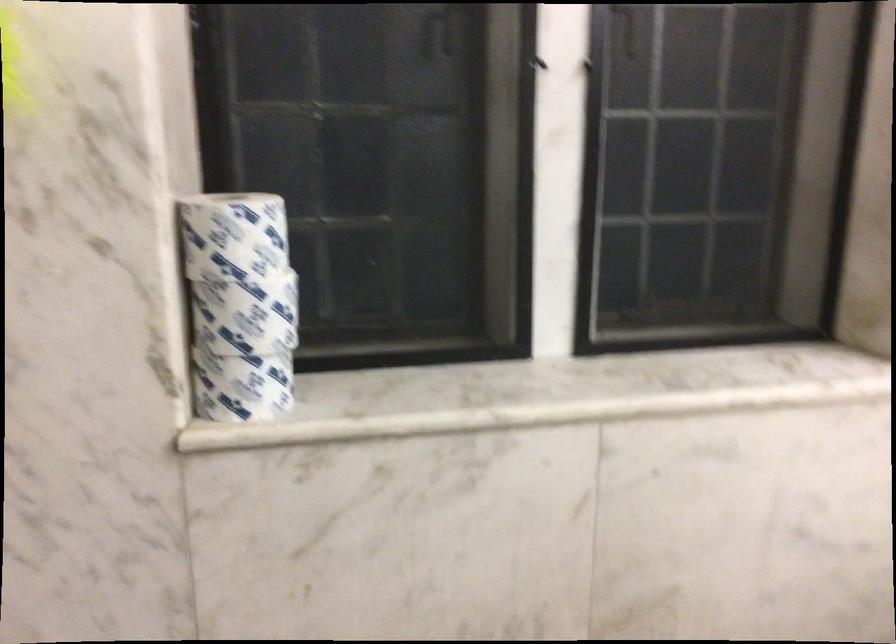
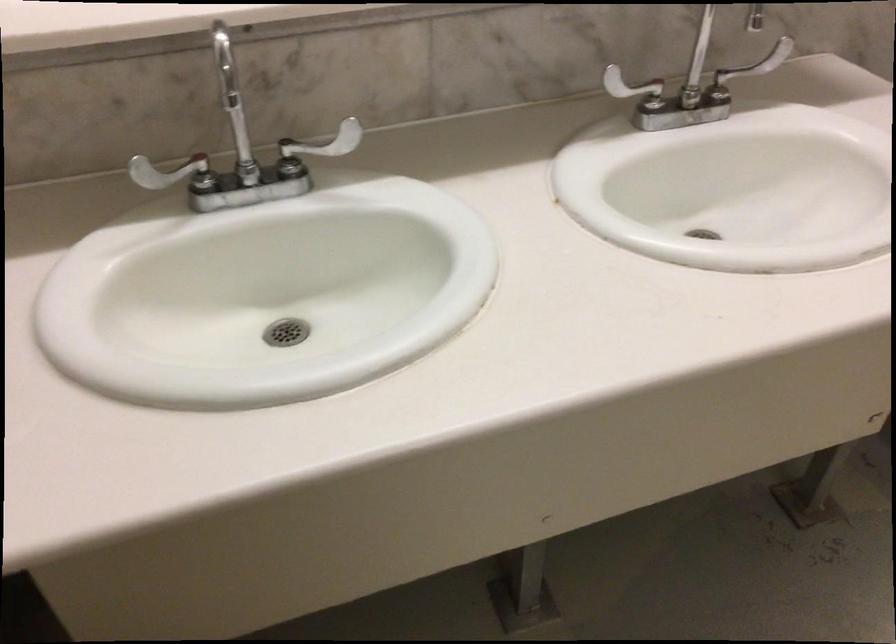
The images are taken continuously from a first-person perspective. In which direction is your viewpoint rotating?

The camera's rotation is toward right-down.